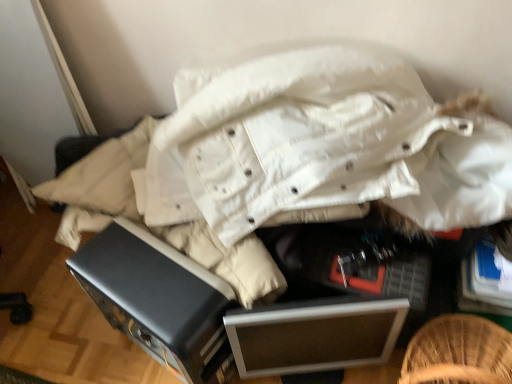
Question: Does black plastic drawer at center have a larger size compared to silver metallic file cabinet at center?

Choices:
 (A) no
 (B) yes

Answer: (B)

Question: Is black plastic drawer at center at the right side of silver metallic file cabinet at center?

Choices:
 (A) no
 (B) yes

Answer: (A)

Question: Is the depth of black plastic drawer at center greater than that of silver metallic file cabinet at center?

Choices:
 (A) yes
 (B) no

Answer: (B)

Question: Does black plastic drawer at center come in front of silver metallic file cabinet at center?

Choices:
 (A) no
 (B) yes

Answer: (B)

Question: Is black plastic drawer at center turned away from silver metallic file cabinet at center?

Choices:
 (A) no
 (B) yes

Answer: (A)

Question: Does black plastic drawer at center appear on the left side of silver metallic file cabinet at center?

Choices:
 (A) no
 (B) yes

Answer: (B)

Question: Could black plastic drawer at center be considered to be inside silver metallic file cabinet at center?

Choices:
 (A) yes
 (B) no

Answer: (B)

Question: Considering the relative sizes of silver metallic file cabinet at center and black plastic drawer at center in the image provided, is silver metallic file cabinet at center wider than black plastic drawer at center?

Choices:
 (A) yes
 (B) no

Answer: (B)

Question: Is silver metallic file cabinet at center bigger than black plastic drawer at center?

Choices:
 (A) yes
 (B) no

Answer: (B)

Question: From a real-world perspective, is silver metallic file cabinet at center on top of black plastic drawer at center?

Choices:
 (A) yes
 (B) no

Answer: (B)

Question: Does silver metallic file cabinet at center have a smaller size compared to black plastic drawer at center?

Choices:
 (A) no
 (B) yes

Answer: (B)

Question: Can you confirm if silver metallic file cabinet at center is taller than black plastic drawer at center?

Choices:
 (A) no
 (B) yes

Answer: (A)

Question: Does point (388, 302) appear closer or farther from the camera than point (289, 342)?

Choices:
 (A) farther
 (B) closer

Answer: (B)